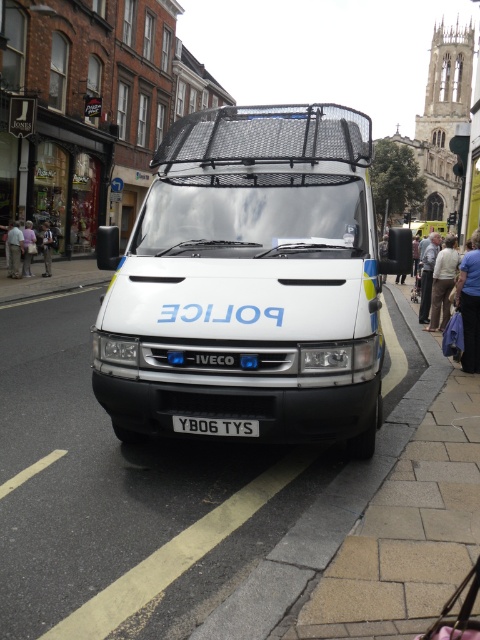
Question: Which of the following is the farthest from the observer?

Choices:
 (A) (227, 116)
 (B) (474, 348)
 (C) (47, 259)
 (D) (196, 417)

Answer: (C)

Question: Is blue denim jacket at lower right to the left of light beige fabric coat at right from the viewer's perspective?

Choices:
 (A) yes
 (B) no

Answer: (A)

Question: Can you confirm if white matte police van at center is positioned below light brown leather jacket at center?

Choices:
 (A) yes
 (B) no

Answer: (A)

Question: From the image, what is the correct spatial relationship of white plastic license plate at center in relation to light beige pants at lower left?

Choices:
 (A) left
 (B) right

Answer: (B)

Question: Which point is closer to the camera taking this photo?

Choices:
 (A) (460, 301)
 (B) (149, 225)

Answer: (B)

Question: Which object is closer to the camera taking this photo?

Choices:
 (A) light beige jacket at center
 (B) white matte police van at center

Answer: (B)